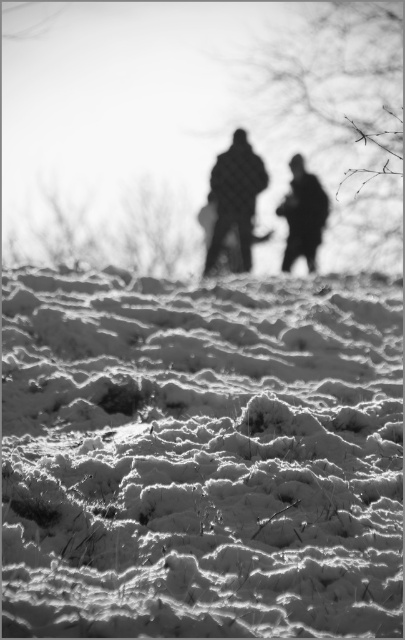
Looking at this image, you are planning to take a photo of the frosted white snow at lower center and the silhouette clothing at center. Which object should you focus on first if you want to capture both in sharp detail?

The frosted white snow at lower center is bigger than the silhouette clothing at center, so focusing on the frosted white snow at lower center first would ensure it is in sharp detail before adjusting for the smaller silhouette clothing at center.

You are a photographer planning to take a new shot of the snowy landscape. You want to ensure that both the frosted white snow at lower center and the silhouette clothing at center are clearly visible in your photo. Given their distance apart, what is the minimum focal length you should use to capture both elements in focus without cropping?

The minimum focal length required to capture both the frosted white snow at lower center and the silhouette clothing at center, which are 6.54 meters apart, would depend on the sensor size of your camera. However, using a wide angle lens with a focal length between 24mm to 35mm is typically suitable for landscapes to ensure both foreground and background elements are in focus and properly framed without cropping.